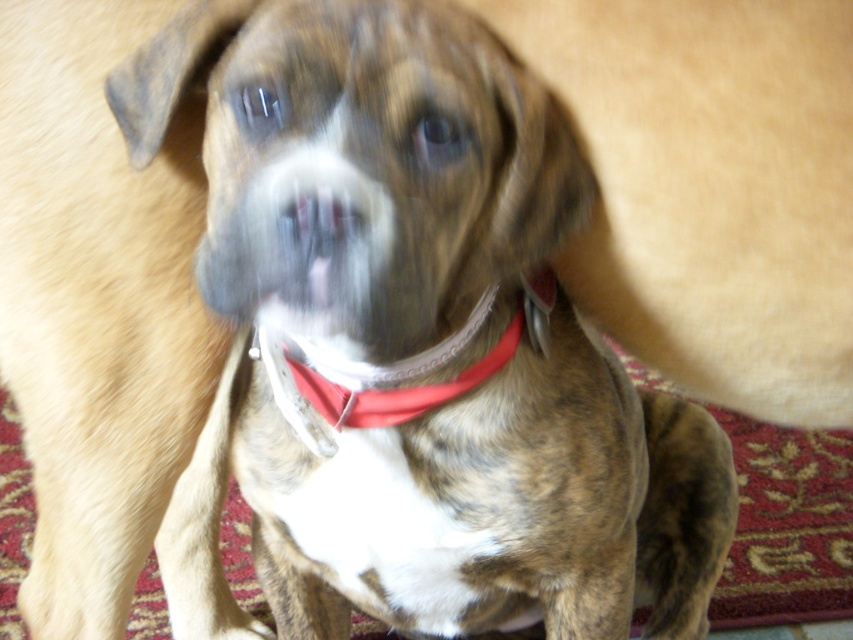
Between point (425, 483) and point (347, 413), which one is positioned behind?

Point (425, 483)

Where is `brown fur dog at center`? brown fur dog at center is located at coordinates (415, 340).

Between point (355, 477) and point (532, 296), which one is positioned behind?

Positioned behind is point (355, 477).

Image resolution: width=853 pixels, height=640 pixels. Identify the location of brown fur dog at center. (415, 340).